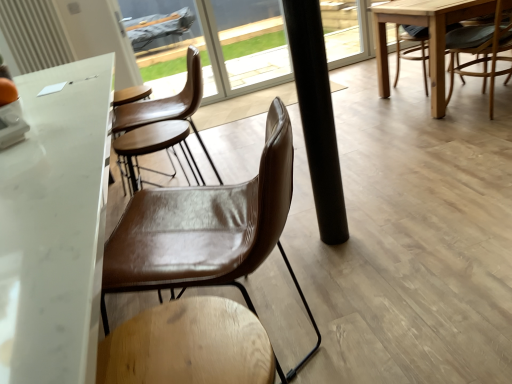
Question: From the image's perspective, is brown leather chair at center, the 2th chair viewed from the right, located above white marble table at center?

Choices:
 (A) no
 (B) yes

Answer: (A)

Question: From a real-world perspective, is brown leather chair at center, which appears as the first chair when viewed from the left, physically below white marble table at center?

Choices:
 (A) no
 (B) yes

Answer: (B)

Question: Considering the relative sizes of brown leather chair at center, which is counted as the 2th chair, starting from the back, and white marble table at center in the image provided, is brown leather chair at center, which is counted as the 2th chair, starting from the back, wider than white marble table at center?

Choices:
 (A) yes
 (B) no

Answer: (B)

Question: From the image's perspective, is brown leather chair at center, the 1th chair positioned from the bottom, located beneath white marble table at center?

Choices:
 (A) yes
 (B) no

Answer: (A)

Question: Are brown leather chair at center, the 1th chair positioned from the bottom, and white marble table at center far apart?

Choices:
 (A) no
 (B) yes

Answer: (A)

Question: From the image's perspective, is white marble table at center above or below brown leather chair at right, acting as the second chair starting from the bottom?

Choices:
 (A) below
 (B) above

Answer: (A)

Question: Is white marble table at center spatially inside brown leather chair at right, acting as the 2th chair starting from the front, or outside of it?

Choices:
 (A) inside
 (B) outside

Answer: (B)

Question: Is point (27, 299) closer or farther from the camera than point (398, 36)?

Choices:
 (A) farther
 (B) closer

Answer: (B)

Question: Considering the relative positions of white marble table at center and brown leather chair at right, which appears as the first chair when viewed from the back, in the image provided, is white marble table at center to the left or to the right of brown leather chair at right, which appears as the first chair when viewed from the back,?

Choices:
 (A) left
 (B) right

Answer: (A)

Question: From a real-world perspective, is brown leather chair at center, which appears as the first chair when viewed from the left, positioned above or below white marble table at center?

Choices:
 (A) above
 (B) below

Answer: (B)

Question: In terms of height, does brown leather chair at center, the 1th chair positioned from the bottom, look taller or shorter compared to white marble table at center?

Choices:
 (A) short
 (B) tall

Answer: (B)

Question: Considering the positions of brown leather chair at center, which is counted as the 2th chair, starting from the back, and white marble table at center in the image, is brown leather chair at center, which is counted as the 2th chair, starting from the back, wider or thinner than white marble table at center?

Choices:
 (A) thin
 (B) wide

Answer: (A)

Question: Is brown leather chair at center, the 2th chair viewed from the right, bigger or smaller than white marble table at center?

Choices:
 (A) big
 (B) small

Answer: (B)

Question: Which is correct: black matte pole at center is inside brown leather chair at right, acting as the second chair starting from the bottom, or outside of it?

Choices:
 (A) outside
 (B) inside

Answer: (A)

Question: Looking at the image, does black matte pole at center seem bigger or smaller compared to brown leather chair at right, placed as the second chair when sorted from left to right?

Choices:
 (A) small
 (B) big

Answer: (A)